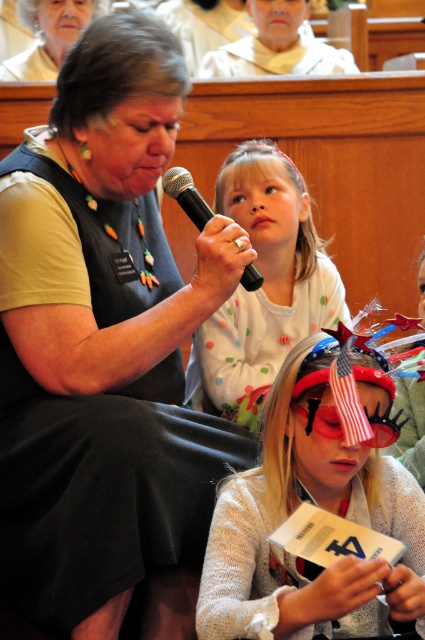
Question: From the image, what is the correct spatial relationship of matte white sweater at center in relation to polka dot shirt at upper center?

Choices:
 (A) above
 (B) below

Answer: (B)

Question: Which point is closer to the camera?

Choices:
 (A) matte beige vest at upper left
 (B) matte black vest at upper left
 (C) matte white sweater at center
 (D) black plastic microphone at upper center

Answer: (C)

Question: Is matte black vest at upper left thinner than polka dot shirt at upper center?

Choices:
 (A) yes
 (B) no

Answer: (B)

Question: Can you confirm if white fabric at upper center is bigger than black plastic microphone at upper center?

Choices:
 (A) yes
 (B) no

Answer: (A)

Question: Among these objects, which one is farthest from the camera?

Choices:
 (A) black plastic microphone at upper center
 (B) matte beige vest at upper left
 (C) matte white sweater at center
 (D) matte black vest at upper left

Answer: (B)

Question: Considering the real-world distances, which object is farthest from the white fabric at upper center?

Choices:
 (A) polka dot shirt at upper center
 (B) matte beige vest at upper left
 (C) matte white sweater at center

Answer: (C)